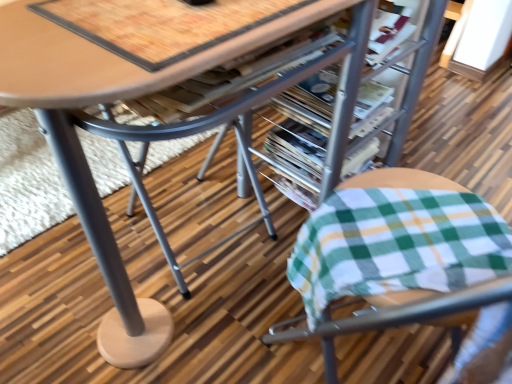
Question: From the image's perspective, relative to metallic silver magazine at center, the first magazine positioned from the front, is wooden table at center above or below?

Choices:
 (A) above
 (B) below

Answer: (B)

Question: Considering the positions of wooden table at center and metallic silver magazine at center, the first magazine positioned from the front, in the image, is wooden table at center bigger or smaller than metallic silver magazine at center, the first magazine positioned from the front,?

Choices:
 (A) big
 (B) small

Answer: (A)

Question: Estimate the real-world distances between objects in this image. Which object is farther from the green plaid fabric cushion at lower right?

Choices:
 (A) metallic silver magazine at center, the second magazine in the front-to-back sequence
 (B) metallic silver magazine at center, the second magazine in the back-to-front sequence
 (C) wooden table at center

Answer: (A)

Question: Which object is positioned closest to the metallic silver magazine at center, the second magazine in the front-to-back sequence?

Choices:
 (A) wooden table at center
 (B) metallic silver magazine at center, the first magazine positioned from the front
 (C) green plaid fabric cushion at lower right

Answer: (B)